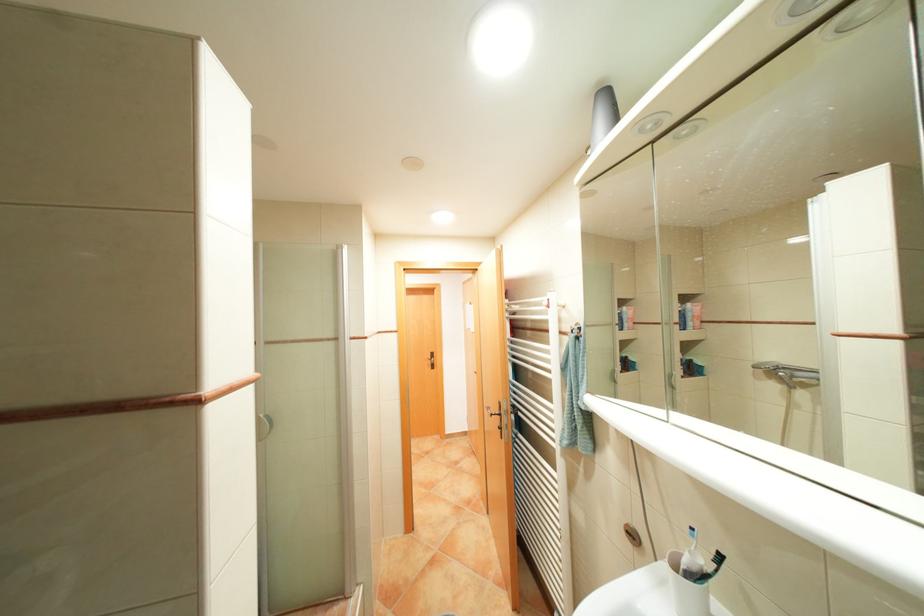
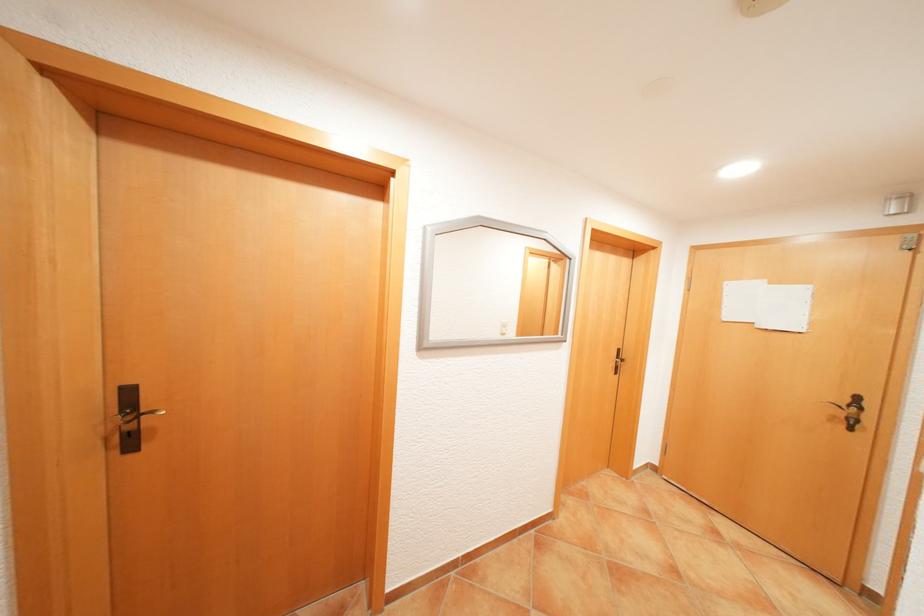
The images are taken continuously from a first-person perspective. In which direction are you moving?

The movement direction of the cameraman is left, forward.